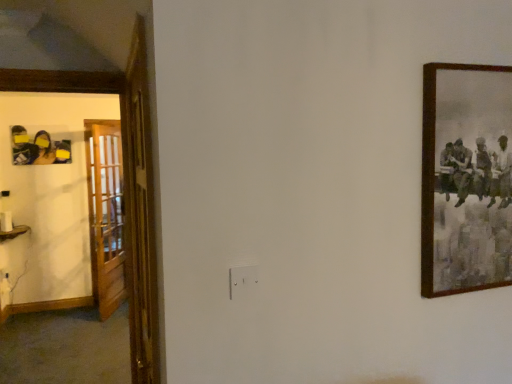
Question: Is matte black photo frame at left positioned before wooden picture frame at right?

Choices:
 (A) yes
 (B) no

Answer: (B)

Question: Considering the relative positions of matte black photo frame at left and wooden picture frame at right in the image provided, is matte black photo frame at left to the right of wooden picture frame at right from the viewer's perspective?

Choices:
 (A) yes
 (B) no

Answer: (B)

Question: From the image's perspective, is matte black photo frame at left located above wooden picture frame at right?

Choices:
 (A) no
 (B) yes

Answer: (B)

Question: Does matte black photo frame at left have a larger size compared to wooden picture frame at right?

Choices:
 (A) no
 (B) yes

Answer: (A)

Question: Is wooden picture frame at right a part of matte black photo frame at left?

Choices:
 (A) yes
 (B) no

Answer: (B)

Question: Is wooden door at left, marked as the 2th door in a left-to-right arrangement, wider or thinner than wooden at left, acting as the 2th door starting from the right?

Choices:
 (A) thin
 (B) wide

Answer: (B)

Question: Is wooden door at left, marked as the 2th door in a left-to-right arrangement, taller or shorter than wooden at left, the 1th door positioned from the back?

Choices:
 (A) short
 (B) tall

Answer: (A)

Question: From the image's perspective, is wooden door at left, which is counted as the first door, starting from the right, above or below wooden at left, the first door positioned from the left?

Choices:
 (A) below
 (B) above

Answer: (B)

Question: Is wooden door at left, marked as the second door in a back-to-front arrangement, to the left or to the right of wooden at left, which is the 2th door from front to back, in the image?

Choices:
 (A) right
 (B) left

Answer: (A)

Question: Is wooden picture frame at right situated inside wooden at left, acting as the 2th door starting from the right, or outside?

Choices:
 (A) inside
 (B) outside

Answer: (B)

Question: Considering the positions of wooden picture frame at right and wooden at left, the 1th door positioned from the back, in the image, is wooden picture frame at right bigger or smaller than wooden at left, the 1th door positioned from the back,?

Choices:
 (A) small
 (B) big

Answer: (A)

Question: Relative to wooden at left, the 1th door positioned from the back, is wooden picture frame at right in front or behind?

Choices:
 (A) front
 (B) behind

Answer: (A)

Question: Is point (449, 77) positioned closer to the camera than point (118, 147)?

Choices:
 (A) closer
 (B) farther

Answer: (A)

Question: In terms of height, does wooden picture frame at right look taller or shorter compared to matte black photo frame at left?

Choices:
 (A) tall
 (B) short

Answer: (A)

Question: In the image, is wooden picture frame at right on the left side or the right side of matte black photo frame at left?

Choices:
 (A) left
 (B) right

Answer: (B)